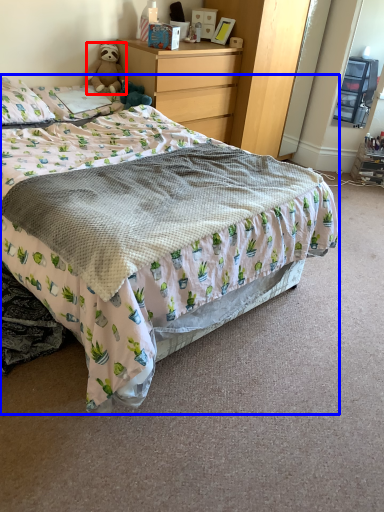
Question: Which object is further to the camera taking this photo, teddy bear (highlighted by a red box) or bed (highlighted by a blue box)?

Choices:
 (A) teddy bear
 (B) bed

Answer: (A)